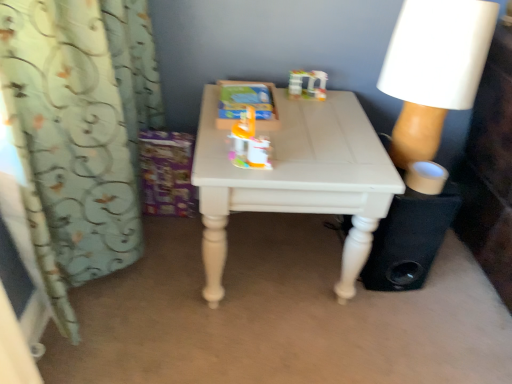
Question: From a real-world perspective, is black fabric speaker at lower right positioned above or below white painted wood table at center?

Choices:
 (A) above
 (B) below

Answer: (B)

Question: Considering the positions of black fabric speaker at lower right and white painted wood table at center in the image, is black fabric speaker at lower right wider or thinner than white painted wood table at center?

Choices:
 (A) wide
 (B) thin

Answer: (B)

Question: Which of these objects is positioned closest to the light blue fabric curtain at left?

Choices:
 (A) white matte lampshade at upper right
 (B) black fabric speaker at lower right
 (C) translucent plastic toy at upper center, which is counted as the second toy, starting from the front
 (D) white painted wood table at center
 (E) orange plastic toy at center, positioned as the 2th toy in right-to-left order

Answer: (D)

Question: Which is nearer to the orange plastic toy at center, the 1th toy when ordered from left to right?

Choices:
 (A) light blue fabric curtain at left
 (B) translucent plastic toy at upper center, which is counted as the second toy, starting from the front
 (C) black fabric speaker at lower right
 (D) white matte lampshade at upper right
 (E) white painted wood table at center

Answer: (E)